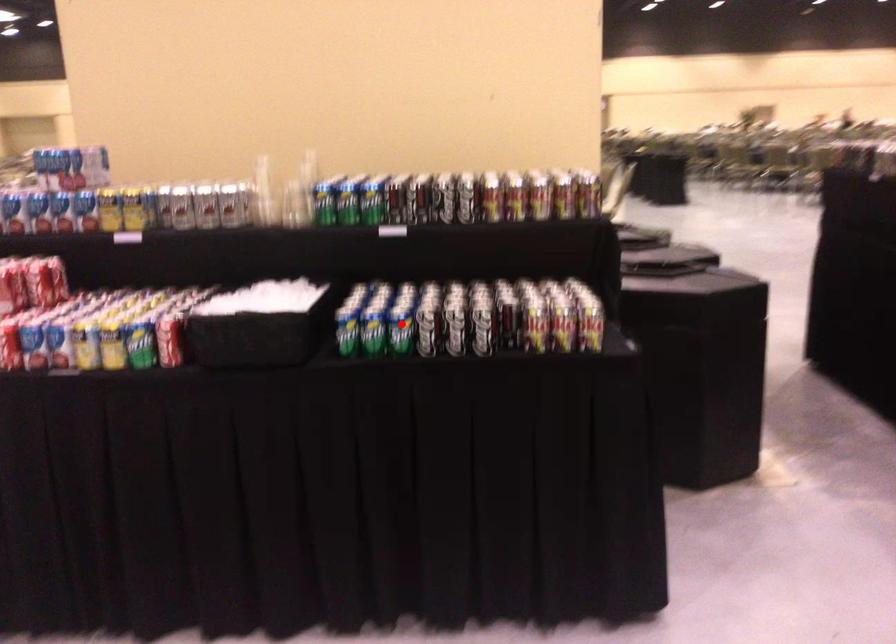
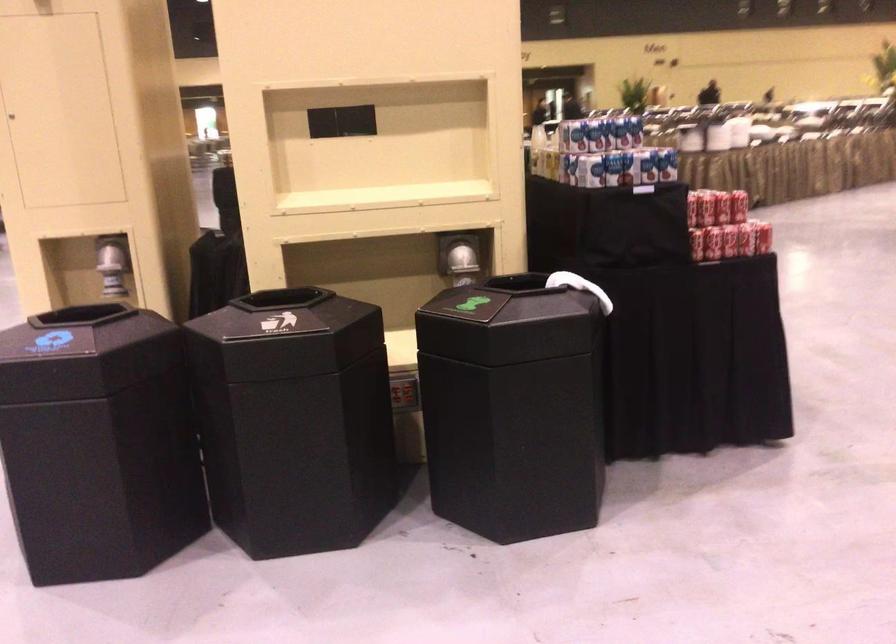
Question: I am providing you with two images of the same scene from different viewpoints. A red point is marked on the first image. Can you still see the location of the red point in image 2?

Choices:
 (A) Yes
 (B) No

Answer: (B)